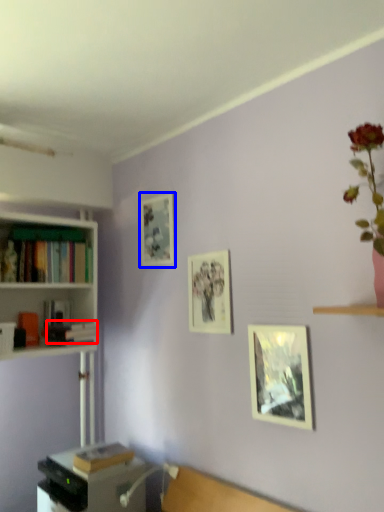
Question: Among these objects, which one is farthest to the camera, book (highlighted by a red box) or picture frame (highlighted by a blue box)?

Choices:
 (A) book
 (B) picture frame

Answer: (B)